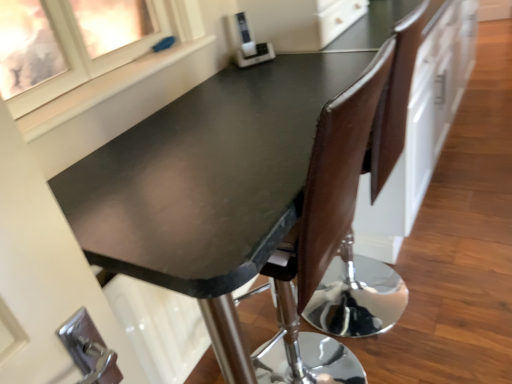
Where is `free point above matte black table at center (from a real-world perspective)`? free point above matte black table at center (from a real-world perspective) is located at coordinates (231, 135).